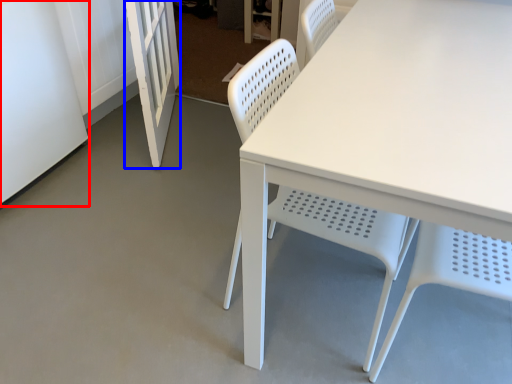
Question: Among these objects, which one is nearest to the camera, screen door (highlighted by a red box) or screen door (highlighted by a blue box)?

Choices:
 (A) screen door
 (B) screen door

Answer: (A)